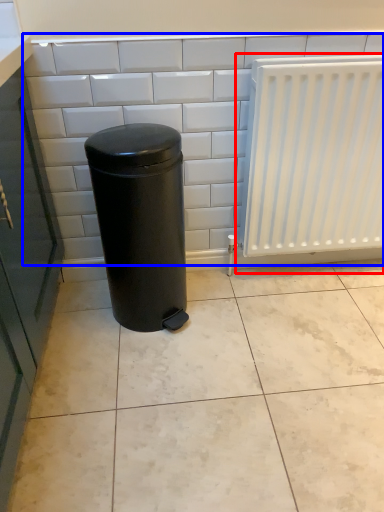
Question: Which point is closer to the camera, radiator (highlighted by a red box) or ceramic tile (highlighted by a blue box)?

Choices:
 (A) radiator
 (B) ceramic tile

Answer: (A)